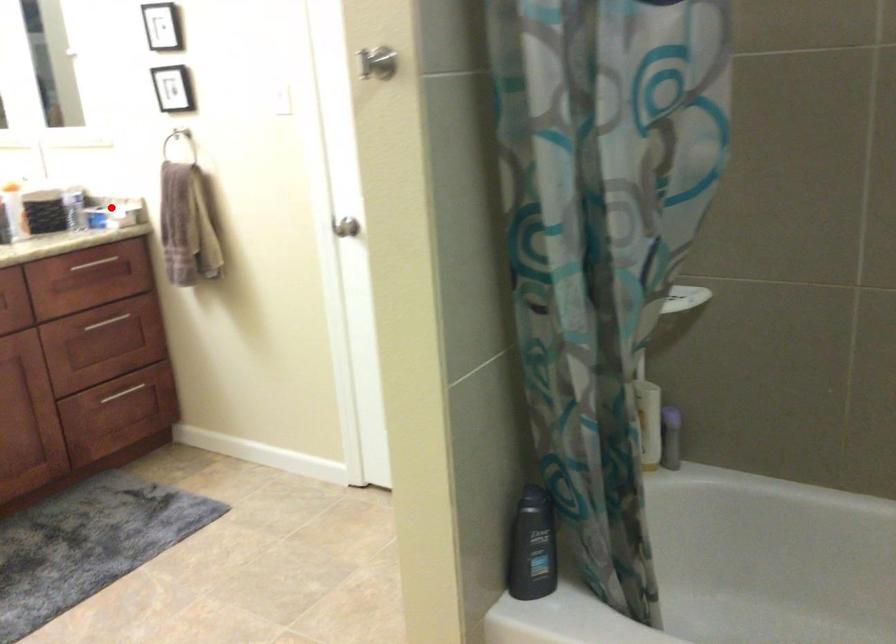
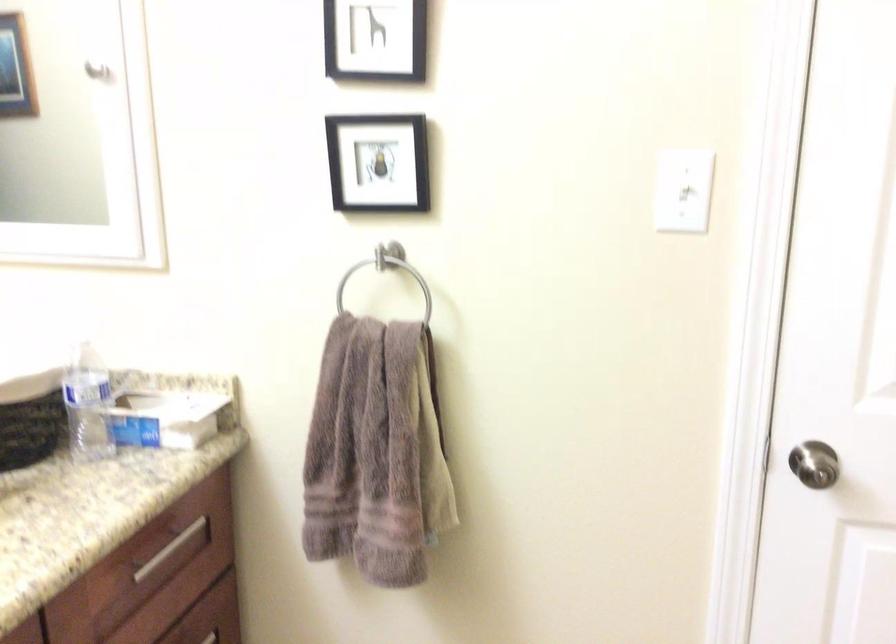
Question: I am providing you with two images of the same scene from different viewpoints. A red point is shown in image1. For the corresponding object point in image2, is it positioned nearer or farther from the camera?

Choices:
 (A) Nearer
 (B) Farther

Answer: (A)